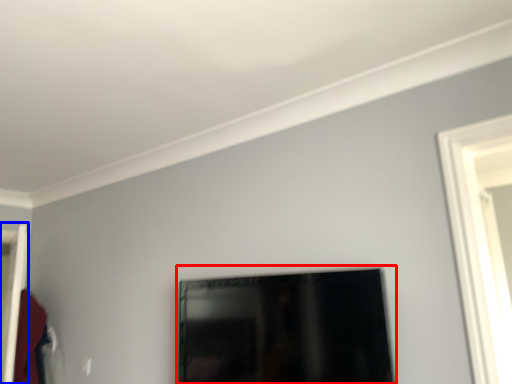
Question: Which point is closer to the camera, picture frame (highlighted by a red box) or door (highlighted by a blue box)?

Choices:
 (A) picture frame
 (B) door

Answer: (A)